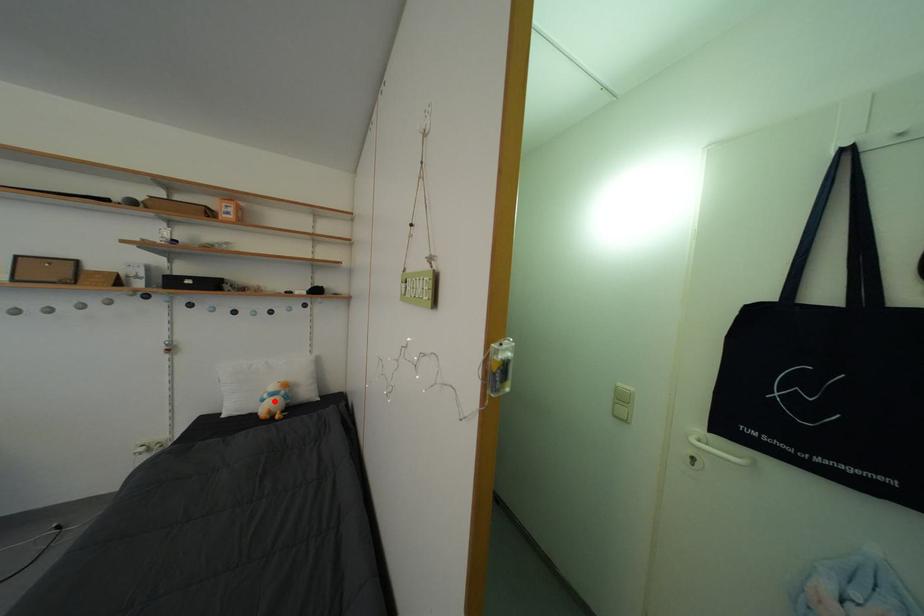
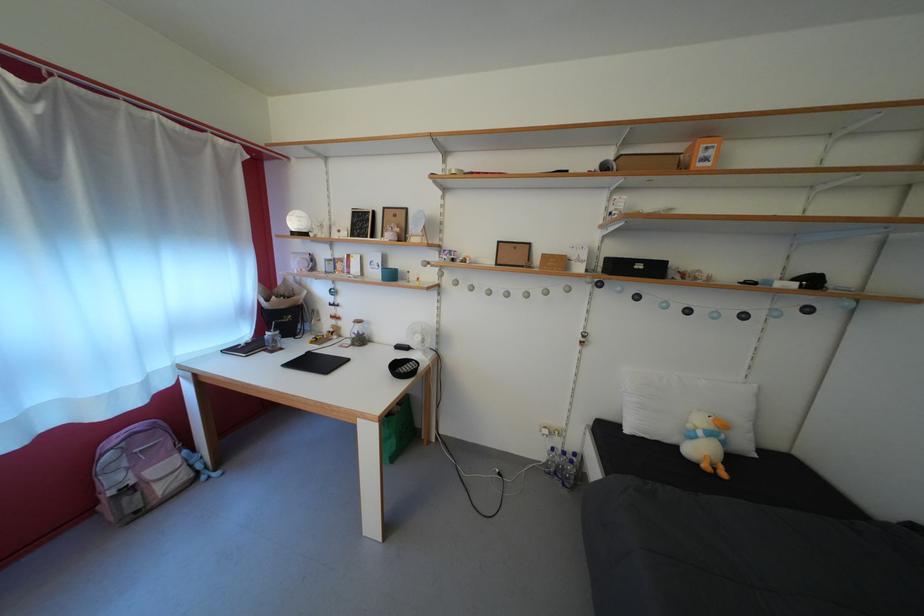
Locate, in the second image, the point that corresponds to the highlighted location in the first image.

(709, 439)